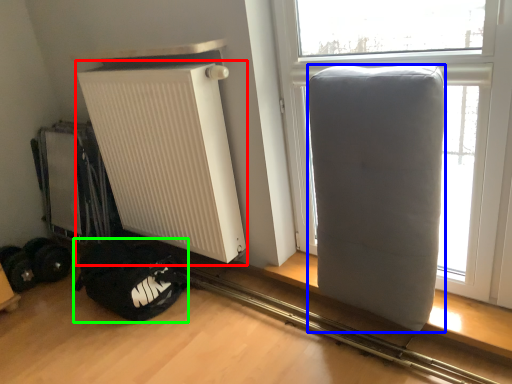
Question: Which object is the farthest from radiator (highlighted by a red box)? Choose among these: furniture (highlighted by a blue box) or sleeping bag (highlighted by a green box).

Choices:
 (A) furniture
 (B) sleeping bag

Answer: (A)